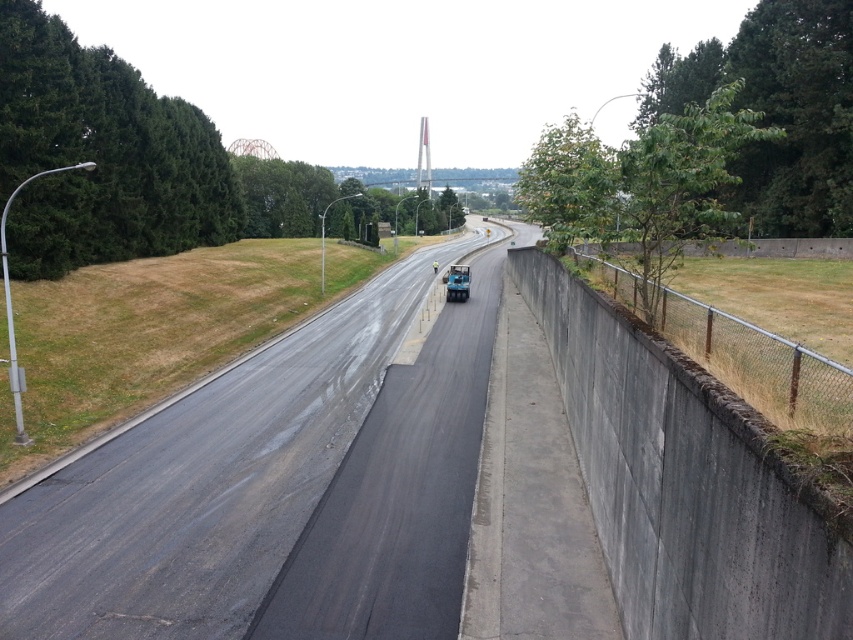
Question: Which object is closer to the camera taking this photo?

Choices:
 (A) metallic blue truck at center
 (B) black asphalt road at center

Answer: (B)

Question: From the image, what is the correct spatial relationship of black asphalt road at center in relation to metallic blue truck at center?

Choices:
 (A) below
 (B) above

Answer: (A)

Question: Observing the image, what is the correct spatial positioning of black asphalt road at center in reference to metallic blue truck at center?

Choices:
 (A) left
 (B) right

Answer: (A)

Question: Which point appears closest to the camera in this image?

Choices:
 (A) pyautogui.click(x=4, y=593)
 (B) pyautogui.click(x=450, y=289)

Answer: (A)

Question: Which point appears closest to the camera in this image?

Choices:
 (A) (393, 292)
 (B) (467, 269)

Answer: (B)

Question: Does black asphalt road at center come in front of metallic blue truck at center?

Choices:
 (A) no
 (B) yes

Answer: (B)